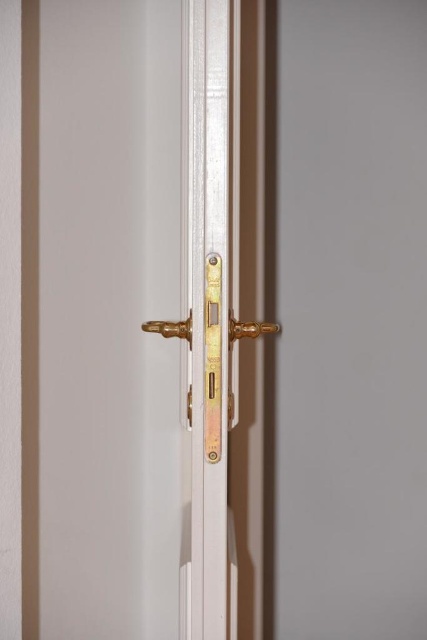
Consider the image. Is white glossy door handle at center below gold metallic door handle at center?

Indeed, white glossy door handle at center is positioned under gold metallic door handle at center.

What do you see at coordinates (131, 317) in the screenshot? This screenshot has height=640, width=427. I see `white glossy door handle at center` at bounding box center [131, 317].

Image resolution: width=427 pixels, height=640 pixels. Identify the location of white glossy door handle at center. (131, 317).

In the scene shown: Can you confirm if polished brass door handle at center is bigger than gold metallic door handle at center?

Actually, polished brass door handle at center might be smaller than gold metallic door handle at center.

Can you confirm if polished brass door handle at center is smaller than gold metallic door handle at center?

Yes, polished brass door handle at center is smaller than gold metallic door handle at center.

Is point (248, 328) positioned after point (187, 332)?

Yes.

Where is `polished brass door handle at center`? The width and height of the screenshot is (427, 640). polished brass door handle at center is located at coordinates (249, 328).

Is gold polished door handle at center thinner than gold metallic door handle at center?

No.

Can you confirm if gold polished door handle at center is taller than gold metallic door handle at center?

Yes, gold polished door handle at center is taller than gold metallic door handle at center.

Is point (187, 396) in front of point (154, 321)?

Yes, point (187, 396) is closer to viewer.

Image resolution: width=427 pixels, height=640 pixels. Identify the location of gold polished door handle at center. [x=211, y=358].